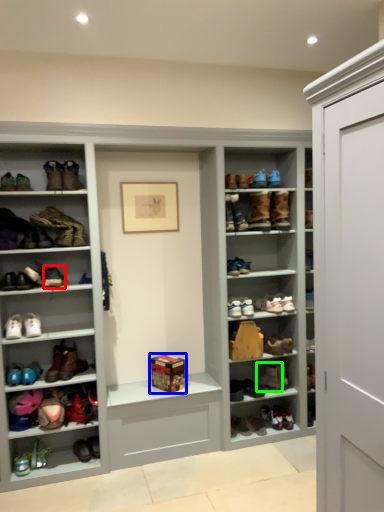
Question: Which is nearer to the footwear (highlighted by a red box)? box (highlighted by a blue box) or footwear (highlighted by a green box).

Choices:
 (A) box
 (B) footwear

Answer: (A)